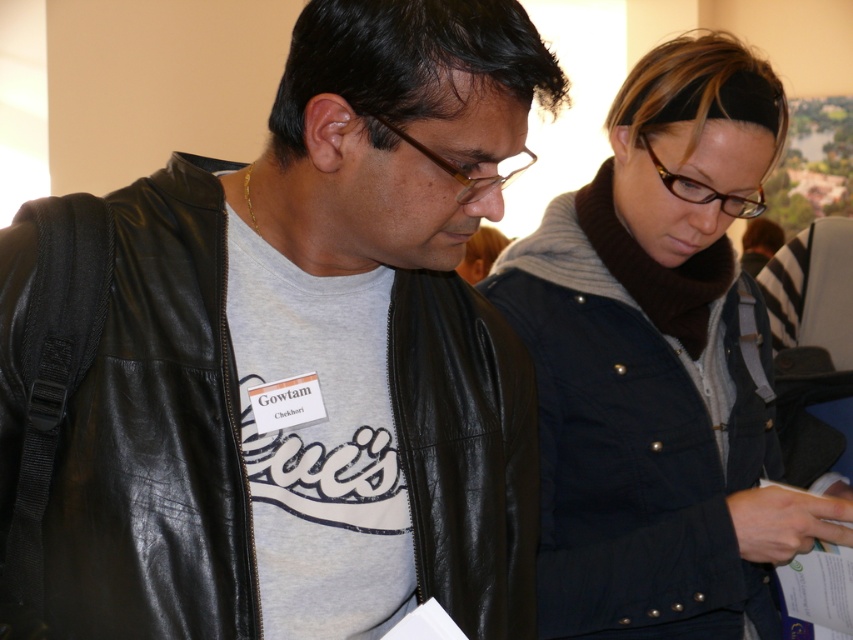
You are standing in a room and see the black leather jacket at left and the dark blue jacket at center. Which jacket is positioned more to the left side of the room?

The black leather jacket at left is positioned more to the left side of the room than the dark blue jacket at center.

You are a photographer at a conference and need to adjust your camera angle to ensure both the black leather jacket at left and the dark blue jacket at center are fully visible. Based on their positions, which jacket should you focus on first to frame the shot properly?

The black leather jacket at left is below the dark blue jacket at center, so you should focus on the dark blue jacket at center first to ensure it stays within the frame while adjusting for the lower positioned black leather jacket at left.

You are standing at the camera position and want to reach the point marked as point (74, 628). If your maximum reach is 1 meter, can you touch it without moving your feet?

The distance between point (74, 628) and the camera is 87.03 centimeters, which is less than 1 meter. Therefore, you can touch it without moving your feet.